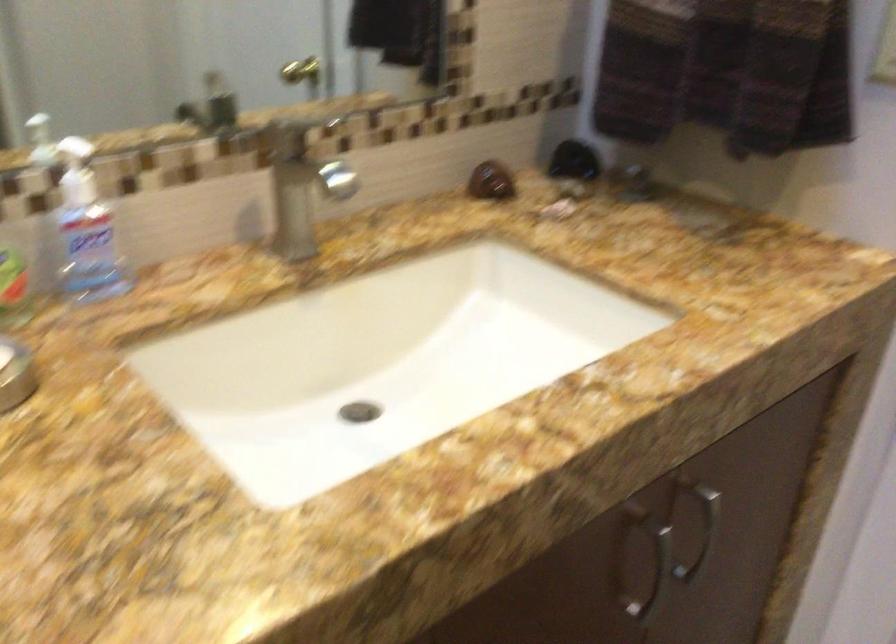
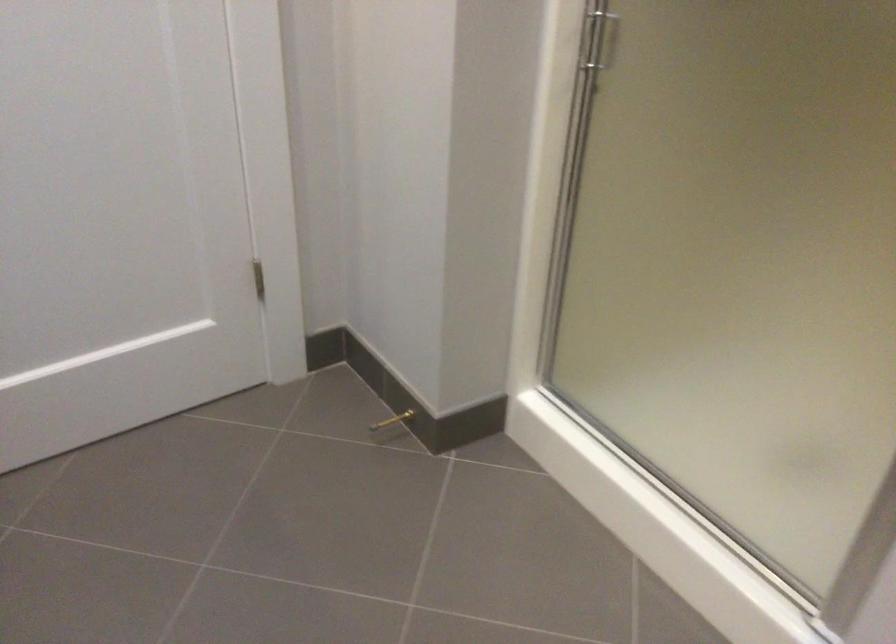
The first image is from the beginning of the video and the second image is from the end. How did the camera likely rotate when shooting the video?

The camera rotated toward right-down.